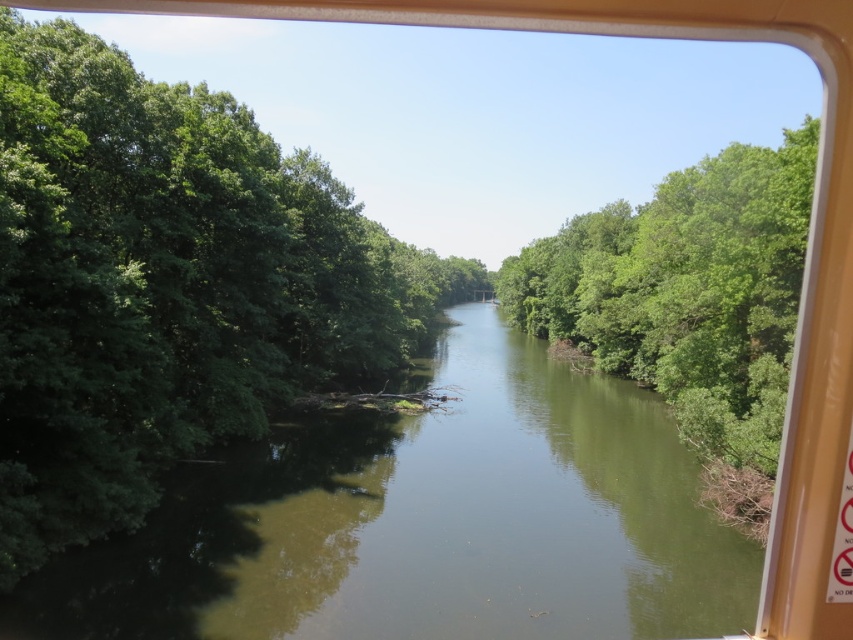
You are standing on a bridge overlooking the river and want to take a photo focusing on the green smooth water at center. However, you notice the green leafy trees at center might block your view. Based on the scene, will the trees obstruct the water in your photo?

The green smooth water at center is smaller than green leafy trees at center, so the trees are larger and may obstruct the view of the water in your photo.

You are standing at the edge of a river and want to toss a stone into the green smooth water at center. Based on the distance provided, can you estimate how many steps you need to take backward to reach the water?

The green smooth water at center is 12.62 meters away from the viewer. Assuming an average step length of 0.76 meters, you would need to take approximately 16.6 steps backward to reach the water.